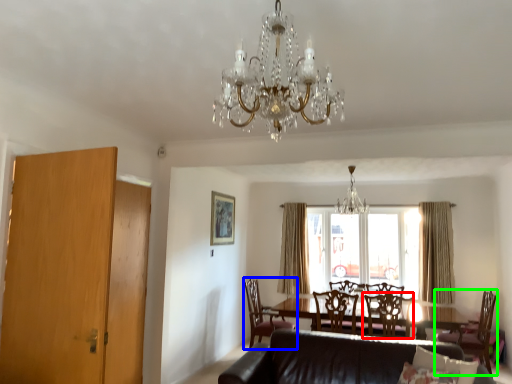
Question: Which is farther away from chair (highlighted by a red box)? chair (highlighted by a blue box) or chair (highlighted by a green box)?

Choices:
 (A) chair
 (B) chair

Answer: (A)